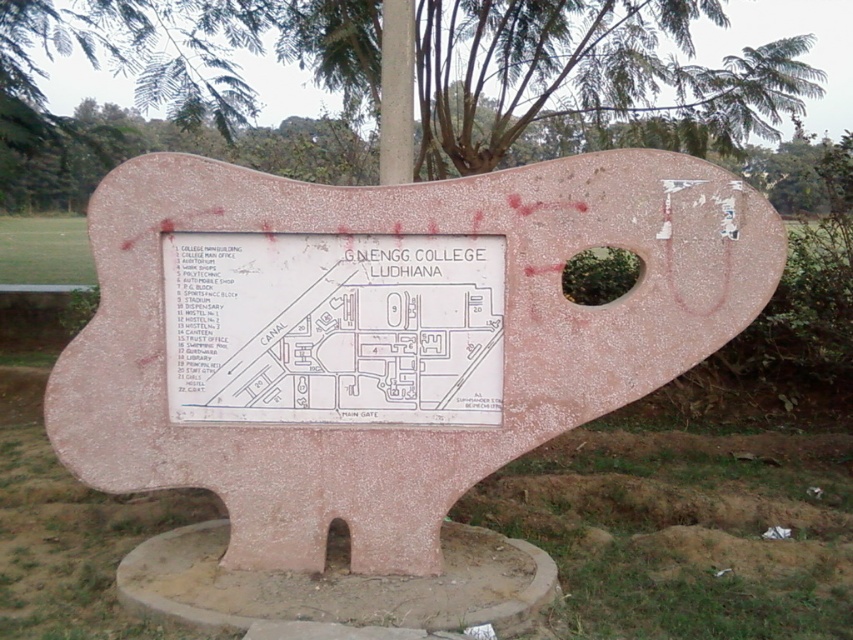
In the scene shown: Who is positioned more to the right, pink stone map at center or metallic pole at upper center?

pink stone map at center

Who is more distant from viewer, (590, 317) or (410, 51)?

Point (410, 51)

Who is more forward, (316, 515) or (404, 122)?

Point (316, 515) is more forward.

Identify the location of pink stone map at center. This screenshot has height=640, width=853. click(x=387, y=336).

Is white stone map at center below metallic pole at upper center?

Correct, white stone map at center is located below metallic pole at upper center.

Does white stone map at center have a greater height compared to metallic pole at upper center?

In fact, white stone map at center may be shorter than metallic pole at upper center.

Is point (486, 307) more distant than point (389, 72)?

No, it is not.

You are a GUI agent. You are given a task and a screenshot of the screen. Output one action in this format:
    pyautogui.click(x=<x>, y=<y>)
    Task: Click on the white stone map at center
    This screenshot has height=640, width=853.
    Given the screenshot: What is the action you would take?
    pyautogui.click(x=334, y=328)

From the picture: Can you confirm if green leafy tree at upper center is taller than white stone map at center?

Correct, green leafy tree at upper center is much taller as white stone map at center.

Describe the element at coordinates (610, 92) in the screenshot. I see `green leafy tree at upper center` at that location.

Identify the location of green leafy tree at upper center. This screenshot has width=853, height=640. pyautogui.click(x=610, y=92).